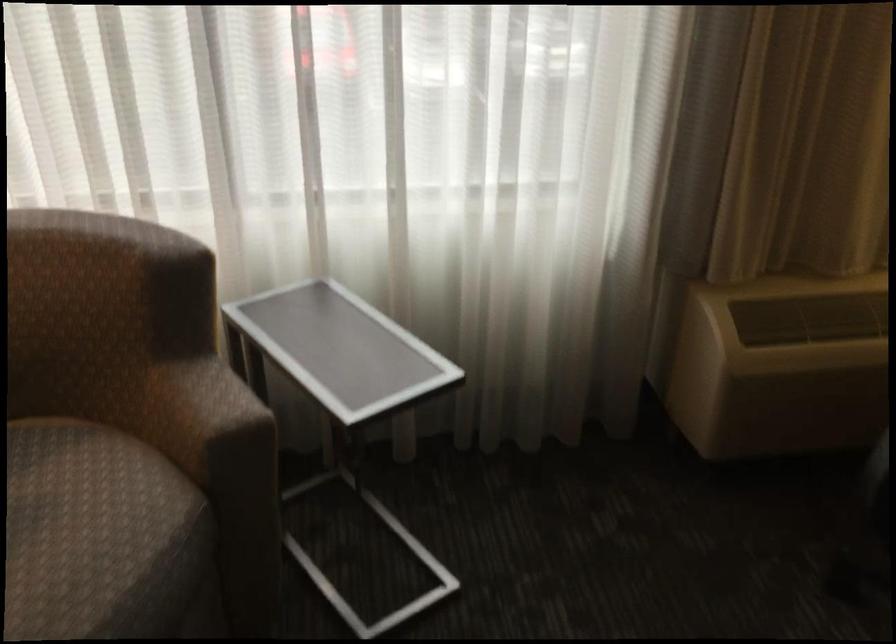
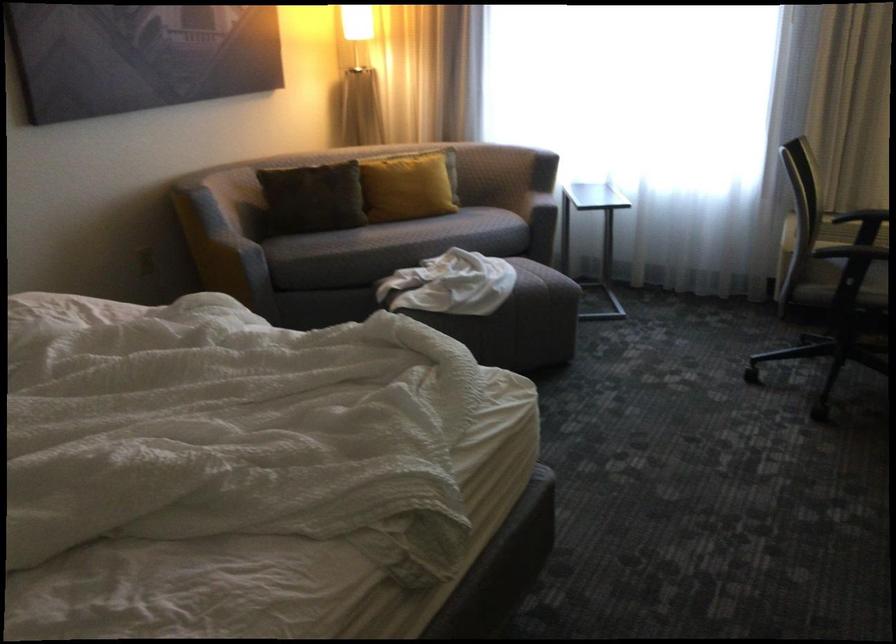
The point at (192, 390) is marked in the first image. Where is the corresponding point in the second image?

(538, 194)